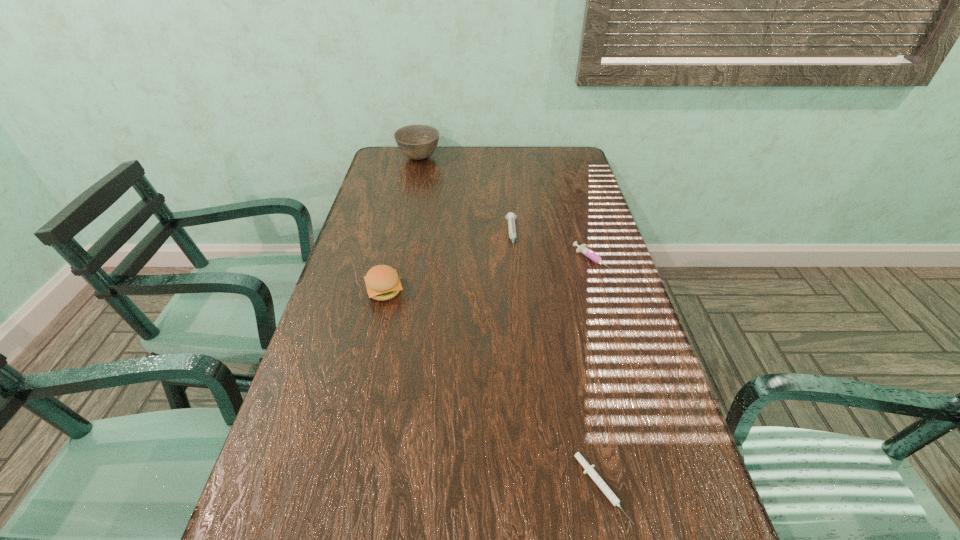
Locate an element on the screen. The image size is (960, 540). empty location between the third object from right to left and the shortest syringe is located at coordinates (557, 362).

Identify which object is the third nearest to the third object from right to left. Please provide its 2D coordinates. Your answer should be formatted as a tuple, i.e. [(x, y)], where the tuple contains the x and y coordinates of a point satisfying the conditions above.

[(417, 142)]

What are the coordinates of `the second closest object to the tallest object` in the screenshot? It's located at (382, 281).

Select which syringe is the closest to the second nearest object. Please provide its 2D coordinates. Your answer should be formatted as a tuple, i.e. [(x, y)], where the tuple contains the x and y coordinates of a point satisfying the conditions above.

[(511, 217)]

You are a GUI agent. You are given a task and a screenshot of the screen. Output one action in this format:
    pyautogui.click(x=<x>, y=<y>)
    Task: Click on the closest syringe to the third object from left to right
    The image size is (960, 540).
    Given the screenshot: What is the action you would take?
    pyautogui.click(x=583, y=249)

This screenshot has height=540, width=960. I want to click on vacant space that satisfies the following two spatial constraints: 1. at the needle end of the third object from right to left; 2. on the right side of the rightmost object, so click(x=515, y=261).

The width and height of the screenshot is (960, 540). Find the location of `vacant space that satisfies the following two spatial constraints: 1. at the needle end of the leftmost syringe; 2. on the left side of the rightmost syringe`. vacant space that satisfies the following two spatial constraints: 1. at the needle end of the leftmost syringe; 2. on the left side of the rightmost syringe is located at coordinates (515, 261).

I want to click on vacant area in the image that satisfies the following two spatial constraints: 1. at the needle end of the second syringe from left to right; 2. on the right side of the third object from right to left, so click(x=535, y=488).

Identify the location of vacant space that satisfies the following two spatial constraints: 1. at the needle end of the rightmost syringe; 2. on the right side of the third object from right to left. The image size is (960, 540). (515, 261).